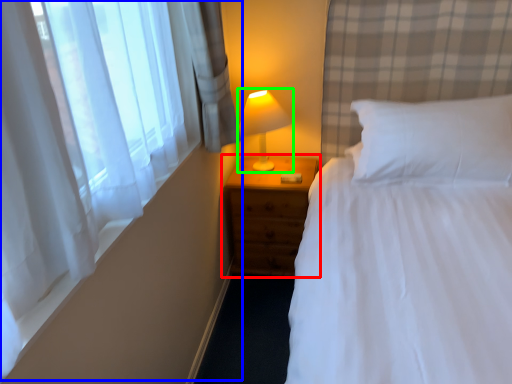
Question: Which object is the closest to the nightstand (highlighted by a red box)? Choose among these: curtain (highlighted by a blue box) or lamp (highlighted by a green box).

Choices:
 (A) curtain
 (B) lamp

Answer: (B)